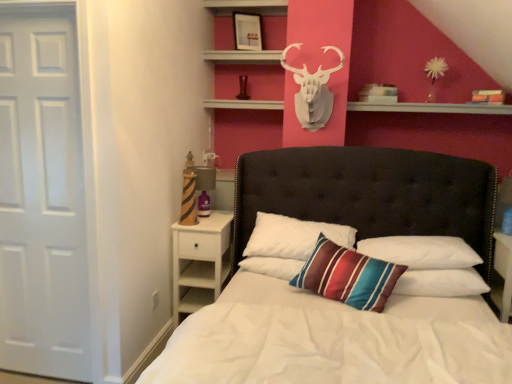
The width and height of the screenshot is (512, 384). I want to click on free space above matte black picture frame at upper center (from a real-world perspective), so click(x=251, y=7).